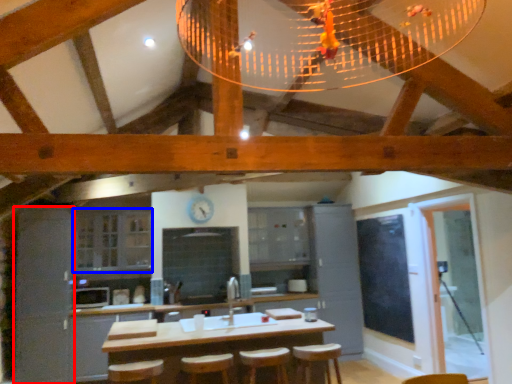
Question: Which object is closer to the camera taking this photo, cabinetry (highlighted by a red box) or cabinetry (highlighted by a blue box)?

Choices:
 (A) cabinetry
 (B) cabinetry

Answer: (A)